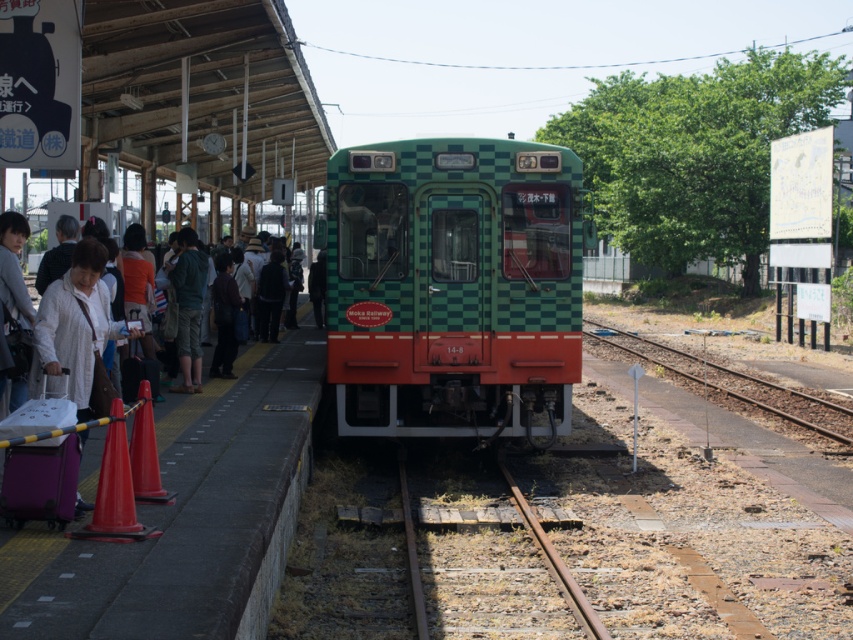
Question: Among these points, which one is nearest to the camera?

Choices:
 (A) (412, 561)
 (B) (508, 316)

Answer: (A)

Question: Does green checkered train at center have a lesser width compared to brown gravel track at lower right?

Choices:
 (A) no
 (B) yes

Answer: (B)

Question: Is rusty metal train track at center bigger than brown gravel track at lower right?

Choices:
 (A) yes
 (B) no

Answer: (B)

Question: Which point appears closest to the camera in this image?

Choices:
 (A) (834, 433)
 (B) (550, 572)

Answer: (B)

Question: Can you confirm if rusty metal train track at center is wider than brown gravel track at lower right?

Choices:
 (A) yes
 (B) no

Answer: (B)

Question: Which object is closer to the camera taking this photo?

Choices:
 (A) rusty metal train track at center
 (B) green checkered train at center
 (C) brown gravel track at lower right

Answer: (A)